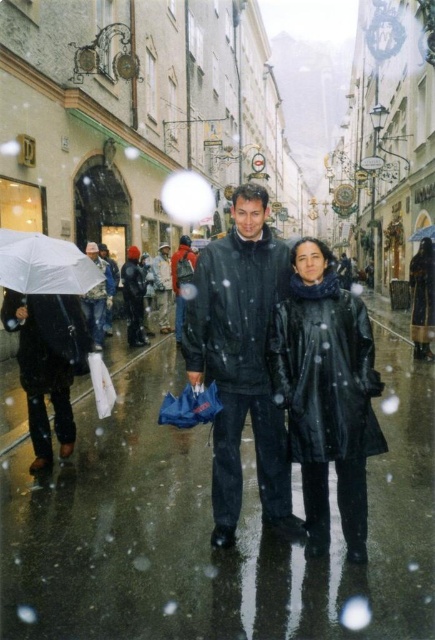
Is matte black coat at center shorter than camouflage jacket at left?

In fact, matte black coat at center may be taller than camouflage jacket at left.

Does matte black coat at center appear over camouflage jacket at left?

Indeed, matte black coat at center is positioned over camouflage jacket at left.

Is point (415, 330) farther from viewer compared to point (94, 332)?

That is False.

Where is `matte black coat at center`? Image resolution: width=435 pixels, height=640 pixels. matte black coat at center is located at coordinates (422, 298).

Who is taller, white matte umbrella at left or dark matte jacket at center?

dark matte jacket at center is taller.

Is white matte umbrella at left further to camera compared to dark matte jacket at center?

No.

Identify the location of white matte umbrella at left. The height and width of the screenshot is (640, 435). (44, 264).

Does glossy asphalt pavement at center have a greater width compared to dark matte jacket at center?

Yes.

Does glossy asphalt pavement at center appear under dark matte jacket at center?

Correct, glossy asphalt pavement at center is located below dark matte jacket at center.

I want to click on glossy asphalt pavement at center, so click(x=210, y=529).

Locate an element on the screen. This screenshot has width=435, height=640. glossy asphalt pavement at center is located at coordinates (210, 529).